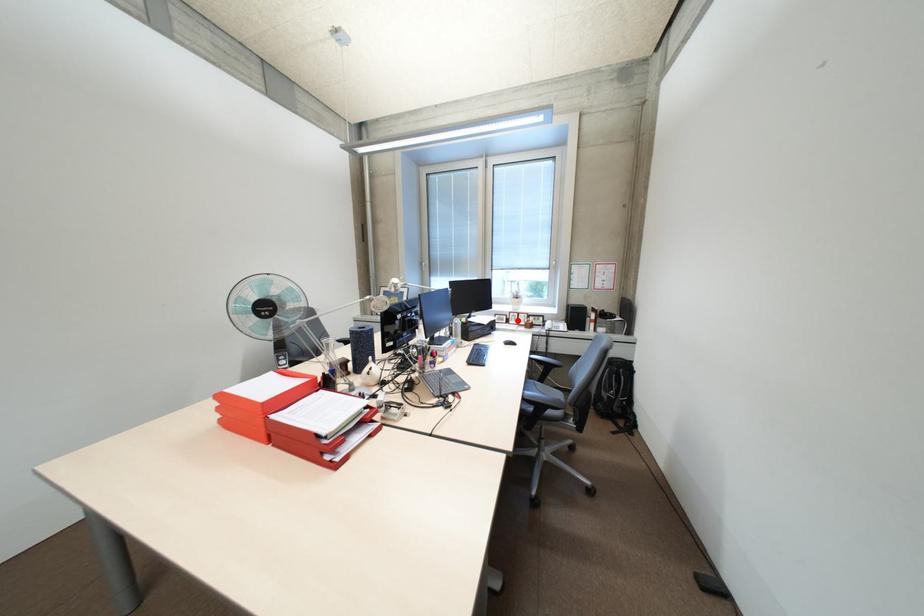
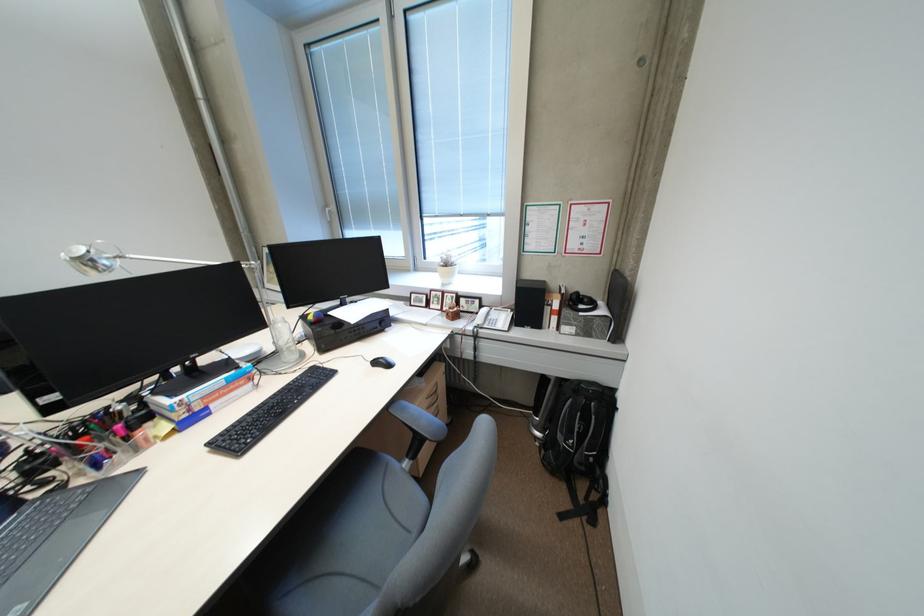
Question: I am providing you with two images of the same scene from different viewpoints. A red point is marked on the first image. Can you still see the location of the red point in image 2?

Choices:
 (A) Yes
 (B) No

Answer: (A)